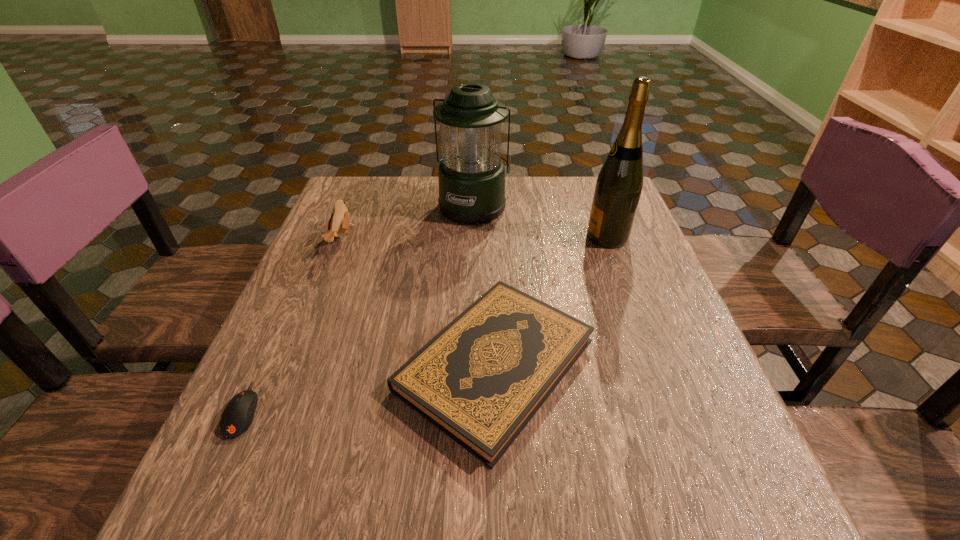
The width and height of the screenshot is (960, 540). What are the coordinates of `the rightmost object` in the screenshot? It's located at (618, 188).

At what (x,y) coordinates should I click in order to perform the action: click on the tallest object. Please return your answer as a coordinate pair (x, y). The width and height of the screenshot is (960, 540). Looking at the image, I should click on (618, 188).

Find the location of a particular element. This screenshot has height=540, width=960. lantern is located at coordinates (471, 174).

This screenshot has height=540, width=960. Identify the location of the third tallest object. (339, 222).

The image size is (960, 540). Identify the location of bird. (339, 222).

Where is `hardback book`? hardback book is located at coordinates pyautogui.click(x=480, y=380).

Locate an element on the screen. The width and height of the screenshot is (960, 540). the shortest object is located at coordinates (237, 417).

I want to click on computer mouse, so pyautogui.click(x=237, y=417).

Where is `vacant space located on the front-facing side of the tallest object`? The image size is (960, 540). vacant space located on the front-facing side of the tallest object is located at coordinates (450, 237).

Where is `free space located 0.250m on the front-facing side of the tallest object`? The image size is (960, 540). free space located 0.250m on the front-facing side of the tallest object is located at coordinates (490, 237).